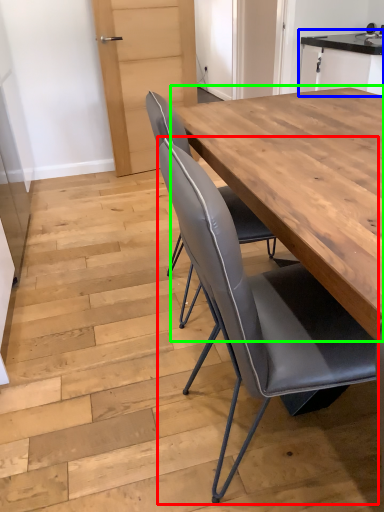
Question: Considering the real-world distances, which object is farthest from chair (highlighted by a red box)? cabinetry (highlighted by a blue box) or table (highlighted by a green box)?

Choices:
 (A) cabinetry
 (B) table

Answer: (A)